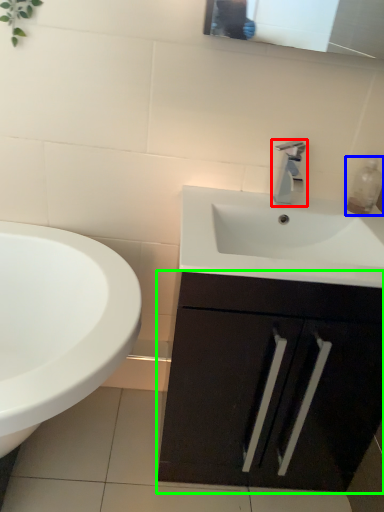
Question: Estimate the real-world distances between objects in this image. Which object is closer to tap (highlighted by a red box), soap dispenser (highlighted by a blue box) or bathroom cabinet (highlighted by a green box)?

Choices:
 (A) soap dispenser
 (B) bathroom cabinet

Answer: (A)